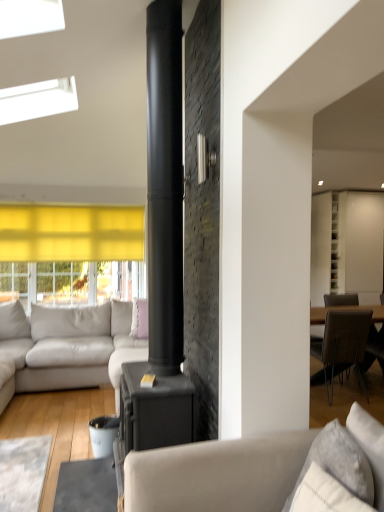
Question: Should I look upward or downward to see pink fabric pillow at center, which is the second pillow in right-to-left order?

Choices:
 (A) down
 (B) up

Answer: (A)

Question: From a real-world perspective, is matte gray couch at center, the 2th studio couch viewed from the left, under white textured pillow at lower right, arranged as the 1th pillow when viewed from the right?

Choices:
 (A) yes
 (B) no

Answer: (A)

Question: Is white textured pillow at lower right, which is the 2th pillow from back to front, surrounded by matte gray couch at center, the 2th studio couch viewed from the left?

Choices:
 (A) yes
 (B) no

Answer: (A)

Question: Does matte gray couch at center, arranged as the second studio couch when viewed from the back, have a larger size compared to white textured pillow at lower right, arranged as the 1th pillow when viewed from the right?

Choices:
 (A) no
 (B) yes

Answer: (B)

Question: Does matte gray couch at center, arranged as the second studio couch when viewed from the back, appear on the right side of white textured pillow at lower right, which is the 2th pillow from back to front?

Choices:
 (A) no
 (B) yes

Answer: (A)

Question: Can you confirm if matte gray couch at center, arranged as the second studio couch when viewed from the back, is taller than white textured pillow at lower right, arranged as the 1th pillow when viewed from the right?

Choices:
 (A) yes
 (B) no

Answer: (A)

Question: Considering the relative sizes of matte gray couch at center, arranged as the second studio couch when viewed from the back, and white textured pillow at lower right, arranged as the 1th pillow when viewed from the right, in the image provided, is matte gray couch at center, arranged as the second studio couch when viewed from the back, thinner than white textured pillow at lower right, arranged as the 1th pillow when viewed from the right,?

Choices:
 (A) no
 (B) yes

Answer: (A)

Question: From the image's perspective, is pink fabric pillow at center, which is the 1th pillow from left to right, over light gray leather couch at left, marked as the 1th studio couch in a back-to-front arrangement?

Choices:
 (A) yes
 (B) no

Answer: (A)

Question: Considering the relative sizes of pink fabric pillow at center, which is the 1th pillow from left to right, and light gray leather couch at left, the second studio couch viewed from the right, in the image provided, is pink fabric pillow at center, which is the 1th pillow from left to right, smaller than light gray leather couch at left, the second studio couch viewed from the right,?

Choices:
 (A) yes
 (B) no

Answer: (A)

Question: Does pink fabric pillow at center, the 2th pillow in the front-to-back sequence, turn towards light gray leather couch at left, which is the 2th studio couch in front-to-back order?

Choices:
 (A) yes
 (B) no

Answer: (A)

Question: Does pink fabric pillow at center, which is the 1th pillow from left to right, lie behind light gray leather couch at left, which is the 2th studio couch in front-to-back order?

Choices:
 (A) no
 (B) yes

Answer: (B)

Question: Is light gray leather couch at left, marked as the 1th studio couch in a back-to-front arrangement, located within pink fabric pillow at center, which is the first pillow from back to front?

Choices:
 (A) no
 (B) yes

Answer: (A)

Question: From a real-world perspective, is pink fabric pillow at center, which is the first pillow from back to front, under light gray leather couch at left, marked as the 1th studio couch in a back-to-front arrangement?

Choices:
 (A) yes
 (B) no

Answer: (B)

Question: Is pink fabric pillow at center, which is the first pillow from back to front, behind white glossy cabinet at upper right?

Choices:
 (A) no
 (B) yes

Answer: (A)